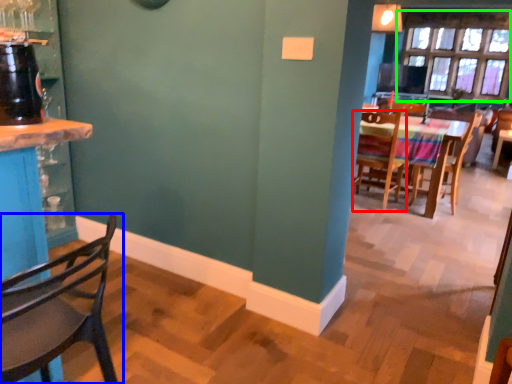
Question: Considering the real-world distances, which object is closest to chair (highlighted by a red box)? chair (highlighted by a blue box) or window (highlighted by a green box).

Choices:
 (A) chair
 (B) window

Answer: (B)